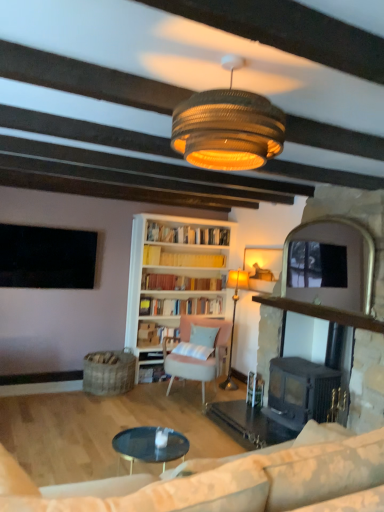
Question: Are hardcover book at center, marked as the third book in a top-to-bottom arrangement, and yellow paperbacks at center, marked as the third book in a bottom-to-top arrangement, located far from each other?

Choices:
 (A) no
 (B) yes

Answer: (B)

Question: Is hardcover book at center, which is the first book from bottom to top, at the right side of yellow paperbacks at center, acting as the 1th book starting from the top?

Choices:
 (A) yes
 (B) no

Answer: (B)

Question: Considering the relative positions of hardcover book at center, which is the first book from bottom to top, and yellow paperbacks at center, acting as the 1th book starting from the top, in the image provided, is hardcover book at center, which is the first book from bottom to top, in front of yellow paperbacks at center, acting as the 1th book starting from the top,?

Choices:
 (A) yes
 (B) no

Answer: (A)

Question: From a real-world perspective, does hardcover book at center, which is the first book from bottom to top, sit lower than yellow paperbacks at center, marked as the third book in a bottom-to-top arrangement?

Choices:
 (A) yes
 (B) no

Answer: (A)

Question: Is hardcover book at center, marked as the third book in a top-to-bottom arrangement, completely or partially outside of yellow paperbacks at center, acting as the 1th book starting from the top?

Choices:
 (A) no
 (B) yes

Answer: (B)

Question: From the image's perspective, is light blue fabric pillow at center above or below yellow paperbacks at center, acting as the 1th book starting from the top?

Choices:
 (A) below
 (B) above

Answer: (A)

Question: Considering the positions of point (213, 339) and point (165, 259), is point (213, 339) closer or farther from the camera than point (165, 259)?

Choices:
 (A) closer
 (B) farther

Answer: (A)

Question: Based on their sizes in the image, would you say light blue fabric pillow at center is bigger or smaller than yellow paperbacks at center, marked as the third book in a bottom-to-top arrangement?

Choices:
 (A) big
 (B) small

Answer: (A)

Question: In the image, is light blue fabric pillow at center positioned in front of or behind yellow paperbacks at center, marked as the third book in a bottom-to-top arrangement?

Choices:
 (A) front
 (B) behind

Answer: (A)

Question: From the image's perspective, is beige fabric couch at lower right above or below hardcover book at center, marked as the third book in a top-to-bottom arrangement?

Choices:
 (A) below
 (B) above

Answer: (B)

Question: Considering their positions, is beige fabric couch at lower right located in front of or behind hardcover book at center, marked as the third book in a top-to-bottom arrangement?

Choices:
 (A) front
 (B) behind

Answer: (A)

Question: Is beige fabric couch at lower right inside the boundaries of hardcover book at center, marked as the third book in a top-to-bottom arrangement, or outside?

Choices:
 (A) outside
 (B) inside

Answer: (A)

Question: From a real-world perspective, is beige fabric couch at lower right physically located above or below hardcover book at center, which is the first book from bottom to top?

Choices:
 (A) above
 (B) below

Answer: (A)

Question: Considering the positions of point (203, 136) and point (175, 374), is point (203, 136) closer or farther from the camera than point (175, 374)?

Choices:
 (A) closer
 (B) farther

Answer: (A)

Question: Is braided wicker lampshade at center, placed as the first lamp when sorted from top to bottom, bigger or smaller than pastel pink fabric chair at center?

Choices:
 (A) big
 (B) small

Answer: (B)